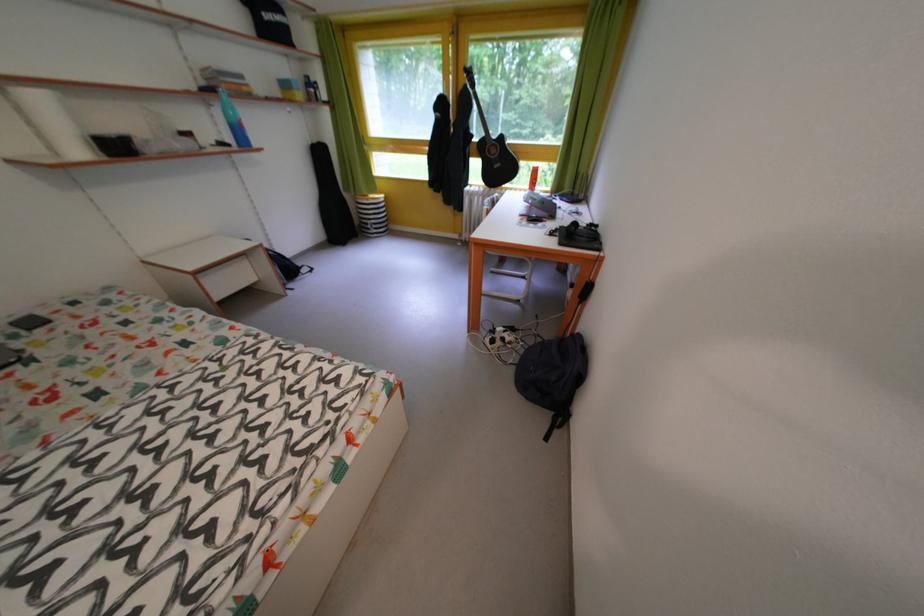
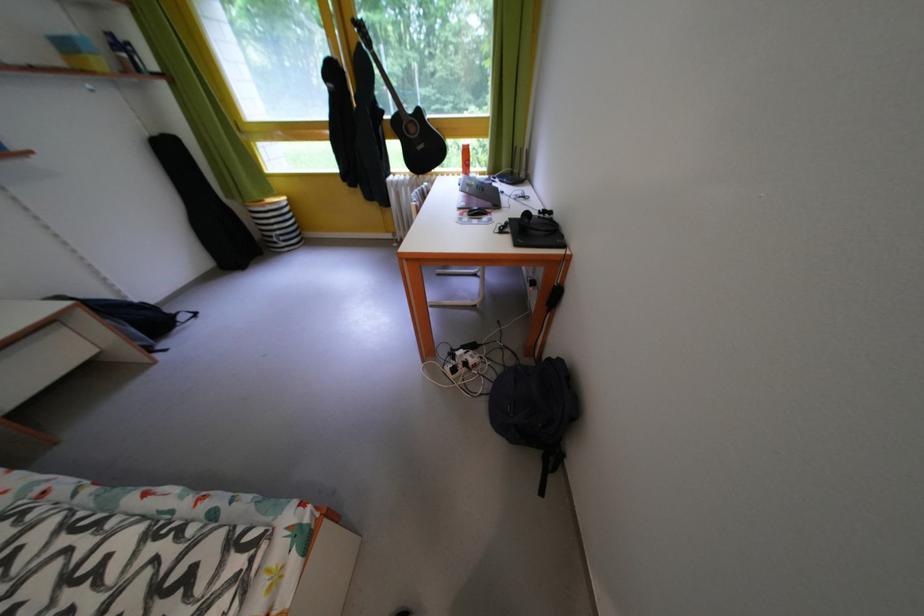
In the second image, find the point that corresponds to (536,175) in the first image.

(465, 153)